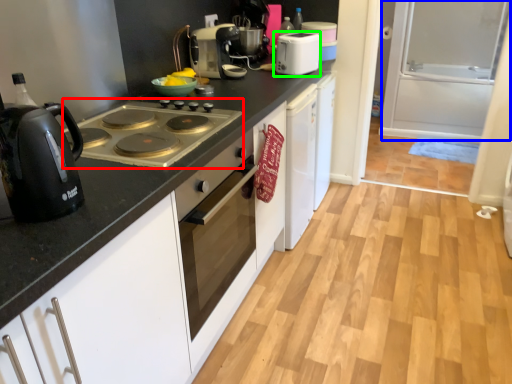
Question: Which object is the farthest from gas stove (highlighted by a red box)? Choose among these: screen door (highlighted by a blue box) or kitchen appliance (highlighted by a green box).

Choices:
 (A) screen door
 (B) kitchen appliance

Answer: (A)